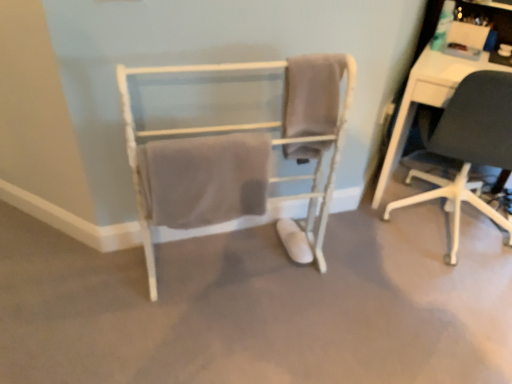
Question: Should I look upward or downward to see beige fabric towel at center, which ranks as the second bath towel in left-to-right order?

Choices:
 (A) down
 (B) up

Answer: (B)

Question: Is beige fabric towel at center, which ranks as the second bath towel in left-to-right order, closer to camera compared to black matte chair at right, the 2th chair viewed from the left?

Choices:
 (A) no
 (B) yes

Answer: (B)

Question: Is beige fabric towel at center, which ranks as the second bath towel in left-to-right order, located outside black matte chair at right, the 2th chair viewed from the left?

Choices:
 (A) no
 (B) yes

Answer: (B)

Question: Can you confirm if beige fabric towel at center, which ranks as the second bath towel in left-to-right order, is positioned to the right of black matte chair at right, the 2th chair viewed from the left?

Choices:
 (A) yes
 (B) no

Answer: (B)

Question: Is beige fabric towel at center, which ranks as the second bath towel in left-to-right order, further to the viewer compared to black matte chair at right, the 2th chair viewed from the left?

Choices:
 (A) yes
 (B) no

Answer: (B)

Question: Does beige fabric towel at center, which ranks as the second bath towel in left-to-right order, have a smaller size compared to black matte chair at right, the 2th chair viewed from the left?

Choices:
 (A) no
 (B) yes

Answer: (B)

Question: Is black matte chair at right, the 2th chair viewed from the left, inside beige fabric towel at center, which ranks as the second bath towel in left-to-right order?

Choices:
 (A) yes
 (B) no

Answer: (B)

Question: Does beige cotton towel at center, which appears as the 2th bath towel when viewed from the right, appear on the right side of black matte chair at right, the 1th chair positioned from the right?

Choices:
 (A) yes
 (B) no

Answer: (B)

Question: Is beige cotton towel at center, arranged as the 1th bath towel when viewed from the left, oriented away from black matte chair at right, the 2th chair viewed from the left?

Choices:
 (A) no
 (B) yes

Answer: (A)

Question: Is beige cotton towel at center, which appears as the 2th bath towel when viewed from the right, not within black matte chair at right, the 1th chair positioned from the right?

Choices:
 (A) no
 (B) yes

Answer: (B)

Question: Does beige cotton towel at center, which appears as the 2th bath towel when viewed from the right, have a greater width compared to black matte chair at right, the 1th chair positioned from the right?

Choices:
 (A) yes
 (B) no

Answer: (B)

Question: Is beige cotton towel at center, which appears as the 2th bath towel when viewed from the right, next to black matte chair at right, the 2th chair viewed from the left?

Choices:
 (A) no
 (B) yes

Answer: (A)

Question: Does black matte chair at right, the 2th chair viewed from the left, have a larger size compared to beige cotton towel at center, which appears as the 2th bath towel when viewed from the right?

Choices:
 (A) no
 (B) yes

Answer: (B)